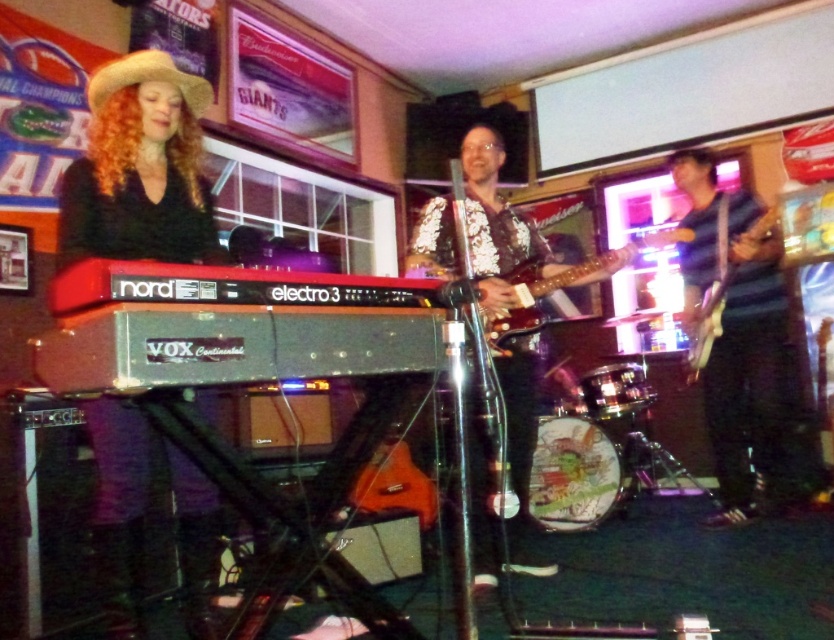
You are a musician who needs to choose a guitar for a performance. The venue requires that the instrument must be large enough to be seen by the audience from the back of the room. Based on the image, which guitar between the glossy wood guitar at center and the shiny black electric guitar at right would you select?

The glossy wood guitar at center has a larger size compared to the shiny black electric guitar at right, so it would be more visible from the back of the room.

You are a photographer setting up for a live music shoot. You need to position your camera so that both the matte black keyboard at center and the shiny black electric guitar at right are in frame. Based on their positions, which object should you focus on first to ensure both are in the shot?

The matte black keyboard at center is below the shiny black electric guitar at right, so you should focus on the shiny black electric guitar at right first to ensure both are in the frame.